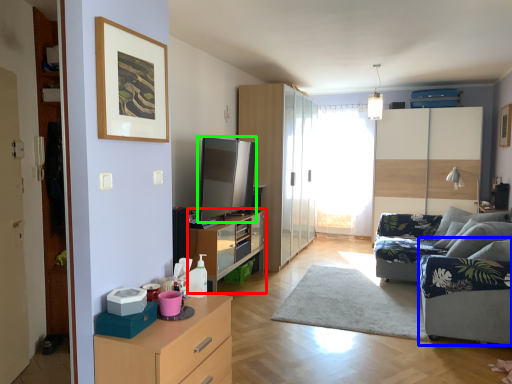
Question: Based on their relative distances, which object is nearer to dresser (highlighted by a red box)? Choose from armchair (highlighted by a blue box) and appliance (highlighted by a green box).

Choices:
 (A) armchair
 (B) appliance

Answer: (B)